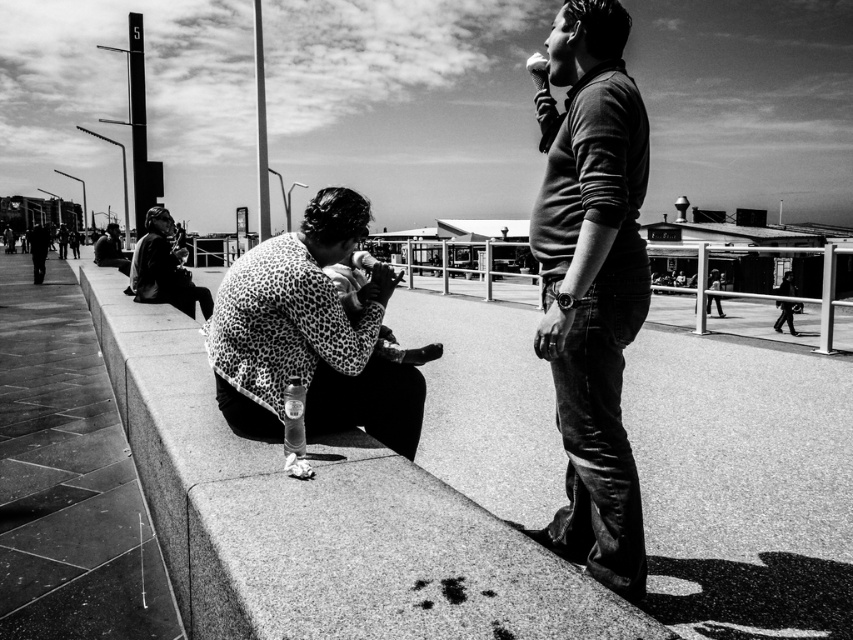
You are a photographer positioned at the granite ledge at lower left and want to take a photo of the leopard print jacket at center. Given that your camera has a maximum focus range of 20 feet, will you be able to capture the jacket clearly?

The granite ledge at lower left is 20.43 feet away from the leopard print jacket at center. Since the distance exceeds the camera maximum focus range of 20 feet, the jacket will be out of focus and not captured clearly.

You are a photographer trying to capture a candid shot of the matte brown sweater at center and the granite ledge at lower left. To ensure both are in focus, you need to know their relative heights. Which object is taller?

The matte brown sweater at center is taller than the granite ledge at lower left.